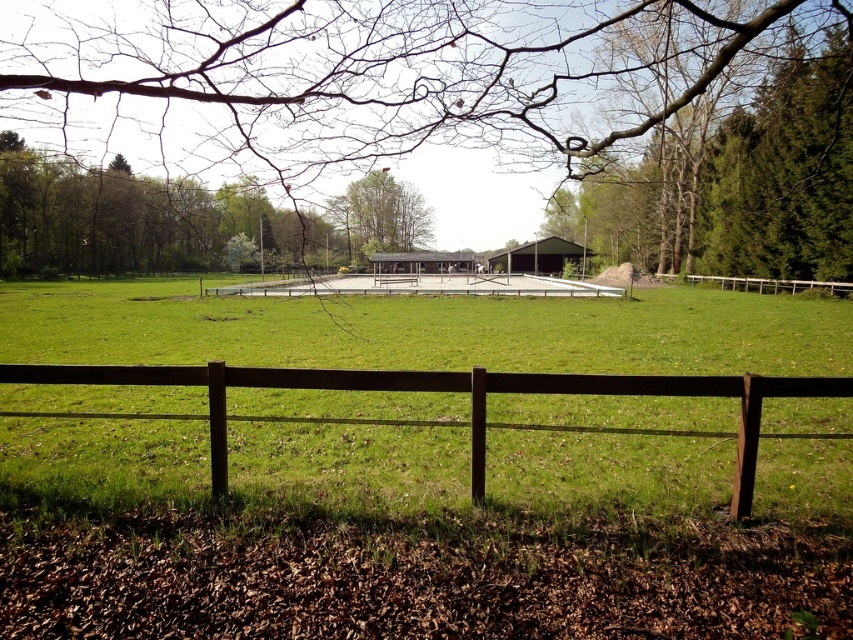
Is brown wooden fence at lower center in front of white concrete fence at center?

Yes.

Is point (474, 452) behind point (531, 280)?

That is False.

Is point (236, 384) farther from camera compared to point (608, 289)?

No.

Identify the location of brown wooden fence at lower center. (450, 390).

Can you confirm if brown wooden fence at lower center is positioned above brown wooden fence at right?

Incorrect, brown wooden fence at lower center is not positioned above brown wooden fence at right.

The height and width of the screenshot is (640, 853). Describe the element at coordinates (450, 390) in the screenshot. I see `brown wooden fence at lower center` at that location.

Find the location of a particular element. The image size is (853, 640). brown wooden fence at lower center is located at coordinates (450, 390).

The image size is (853, 640). I want to click on brown wooden fence at lower center, so click(450, 390).

Is green leafy tree at left bigger than brown wooden fence at lower center?

Correct, green leafy tree at left is larger in size than brown wooden fence at lower center.

Does point (247, 232) come farther from viewer compared to point (209, 387)?

Yes.

Where is `green leafy tree at left`? The width and height of the screenshot is (853, 640). green leafy tree at left is located at coordinates (173, 218).